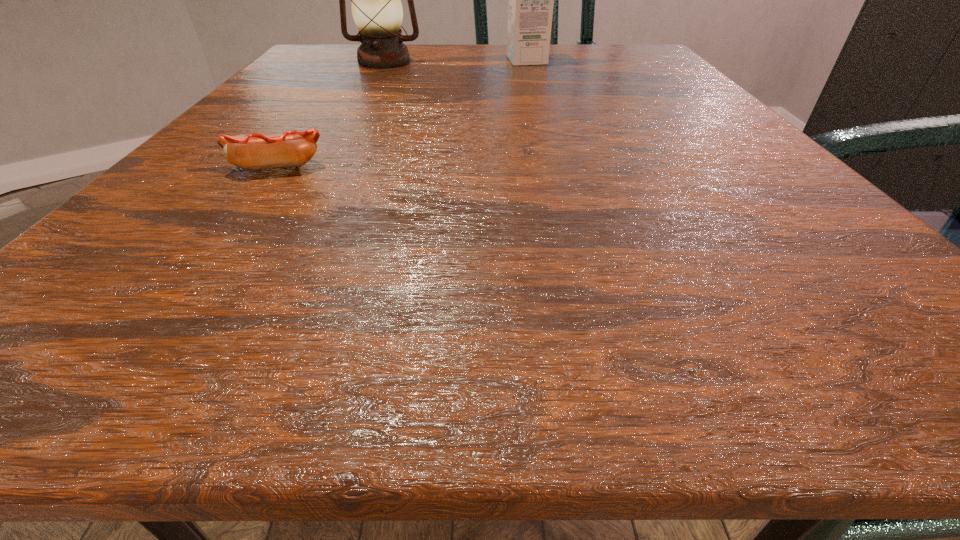
You are a GUI agent. You are given a task and a screenshot of the screen. Output one action in this format:
    pyautogui.click(x=<x>, y=<y>)
    Task: Click on the tallest object
    
    Given the screenshot: What is the action you would take?
    pyautogui.click(x=377, y=11)

You are a GUI agent. You are given a task and a screenshot of the screen. Output one action in this format:
    pyautogui.click(x=<x>, y=<y>)
    Task: Click on the second shortest object
    This screenshot has height=540, width=960.
    Given the screenshot: What is the action you would take?
    530,9

The height and width of the screenshot is (540, 960). Identify the location of carton. (530, 9).

Where is `the shortest object`? The width and height of the screenshot is (960, 540). the shortest object is located at coordinates (289, 149).

The width and height of the screenshot is (960, 540). Find the location of `the nearest object`. the nearest object is located at coordinates (289, 149).

At what (x,y) coordinates should I click in order to perform the action: click on vacant point located 0.380m on the front of the tallest object. Please return your answer as a coordinate pair (x, y). Looking at the image, I should click on (331, 153).

Where is `vacant point located on the left of the second shortest object`? vacant point located on the left of the second shortest object is located at coordinates (480, 60).

Identify the location of vacant region located on the front of the nearest object. (173, 312).

Find the location of a particular element. The width and height of the screenshot is (960, 540). oil lamp situated at the far edge is located at coordinates (377, 11).

The height and width of the screenshot is (540, 960). In order to click on carton that is positioned at the far edge in this screenshot , I will do `click(530, 9)`.